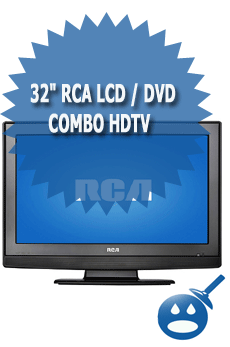
The image size is (230, 347). Find the location of `tv stand`. tv stand is located at coordinates (109, 276).